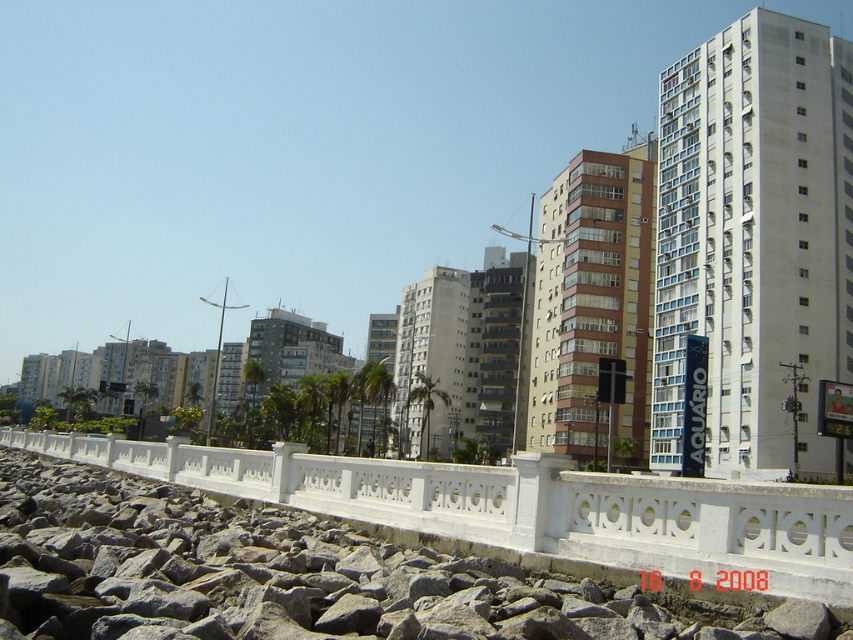
Question: Which point is farther from the camera taking this photo?

Choices:
 (A) (718, 387)
 (B) (618, 451)
 (C) (296, 445)
 (D) (474, 346)

Answer: (D)

Question: Which of the following is the farthest from the observer?

Choices:
 (A) (485, 442)
 (B) (688, 136)
 (C) (160, 461)

Answer: (A)

Question: Can you confirm if white stone fence at center is positioned above white concrete building at center?

Choices:
 (A) no
 (B) yes

Answer: (B)

Question: Which object appears closest to the camera in this image?

Choices:
 (A) white stone fence at center
 (B) brown concrete building at center
 (C) brown glass building at center

Answer: (A)

Question: Is white concrete building at right positioned at the back of white concrete building at center?

Choices:
 (A) yes
 (B) no

Answer: (B)

Question: Can you confirm if white concrete building at center is positioned to the left of brown concrete building at center?

Choices:
 (A) yes
 (B) no

Answer: (A)